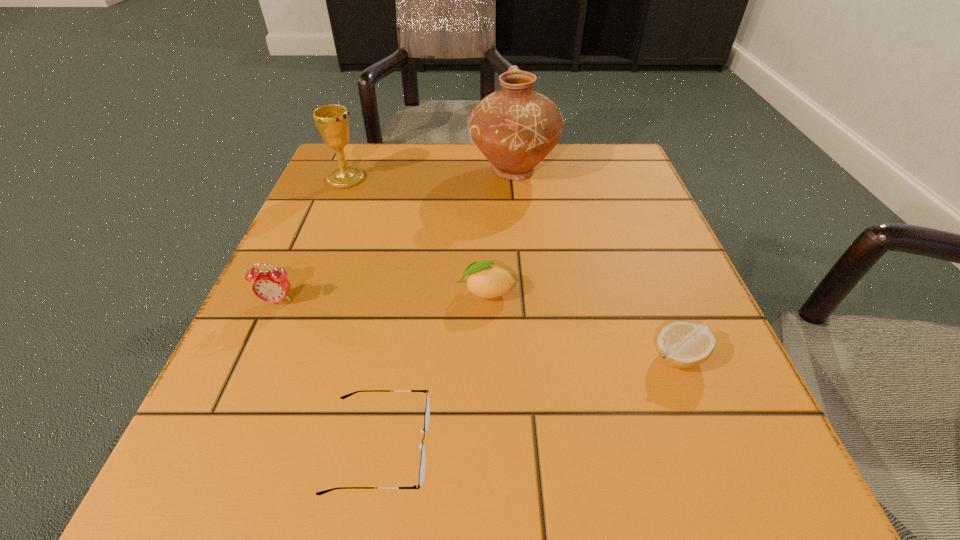
Locate an element on the screen. This screenshot has height=540, width=960. unoccupied position between the nearer lemon and the fourth object from right to left is located at coordinates (529, 401).

In order to click on vacant space that is in between the chalice and the third shortest object in this screenshot , I will do `click(416, 235)`.

Locate an element on the screen. free space between the rightmost object and the third tallest object is located at coordinates (477, 329).

This screenshot has width=960, height=540. What are the coordinates of `empty location between the right lemon and the third tallest object` in the screenshot? It's located at (477, 329).

Where is `vacant region between the fourth tallest object and the fifth shortest object`? vacant region between the fourth tallest object and the fifth shortest object is located at coordinates (416, 235).

I want to click on vacant space that is in between the right lemon and the taller lemon, so click(x=582, y=324).

Where is `vacant area between the chalice and the alarm clock`? vacant area between the chalice and the alarm clock is located at coordinates (312, 240).

Find the location of a particular element. vacant area between the alarm clock and the farther lemon is located at coordinates (382, 296).

Locate an element on the screen. Image resolution: width=960 pixels, height=540 pixels. empty space between the alarm clock and the spectacles is located at coordinates (329, 374).

At what (x,y) coordinates should I click in order to perform the action: click on free space between the tallest object and the taller lemon. Please return your answer as a coordinate pair (x, y). Looking at the image, I should click on (499, 231).